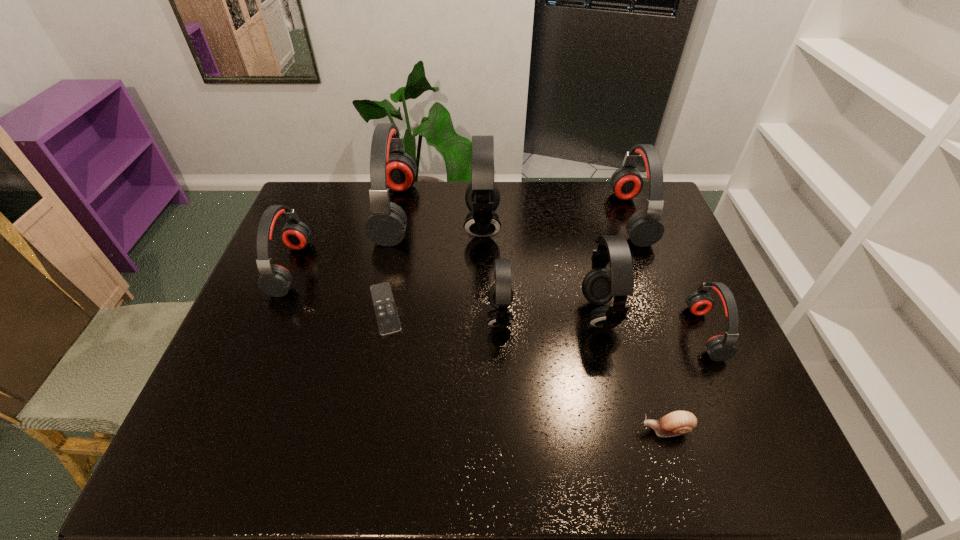
You are a GUI agent. You are given a task and a screenshot of the screen. Output one action in this format:
    pyautogui.click(x=<x>, y=<y>)
    Task: Click on the vacant area that lies between the third biggest red earphone and the third earphone from right to left
    The width and height of the screenshot is (960, 540).
    Given the screenshot: What is the action you would take?
    pyautogui.click(x=445, y=291)

At what (x,y) coordinates should I click in order to perform the action: click on vacant point located between the third red earphone from right to left and the biggest black earphone. Please return your answer as a coordinate pair (x, y). This screenshot has height=540, width=960. Looking at the image, I should click on (439, 219).

The height and width of the screenshot is (540, 960). I want to click on the closest object to the smallest black earphone, so click(482, 197).

The height and width of the screenshot is (540, 960). In order to click on object that stands as the fifth closest to the second red earphone from left to right in this screenshot , I will do `click(599, 286)`.

This screenshot has width=960, height=540. In order to click on earphone that stands as the third closest to the smallest black earphone in this screenshot , I will do `click(390, 167)`.

The height and width of the screenshot is (540, 960). I want to click on earphone identified as the closest to the leftmost earphone, so click(x=390, y=167).

Point out which red earphone is positioned as the second nearest to the second biggest black earphone. Please provide its 2D coordinates. Your answer should be formatted as a tuple, i.e. [(x, y)], where the tuple contains the x and y coordinates of a point satisfying the conditions above.

[(720, 347)]

Identify which red earphone is the second nearest to the eighth tallest object. Please provide its 2D coordinates. Your answer should be formatted as a tuple, i.e. [(x, y)], where the tuple contains the x and y coordinates of a point satisfying the conditions above.

[(645, 228)]

Select which black earphone is the closest to the farthest black earphone. Please provide its 2D coordinates. Your answer should be formatted as a tuple, i.e. [(x, y)], where the tuple contains the x and y coordinates of a point satisfying the conditions above.

[(500, 295)]

Identify which black earphone is the third closest to the shortest object. Please provide its 2D coordinates. Your answer should be formatted as a tuple, i.e. [(x, y)], where the tuple contains the x and y coordinates of a point satisfying the conditions above.

[(599, 286)]